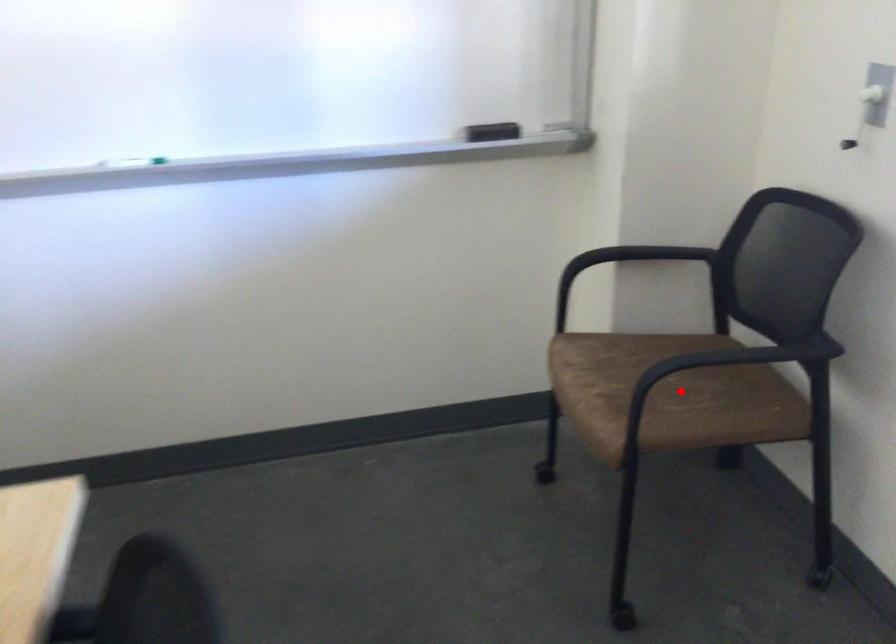
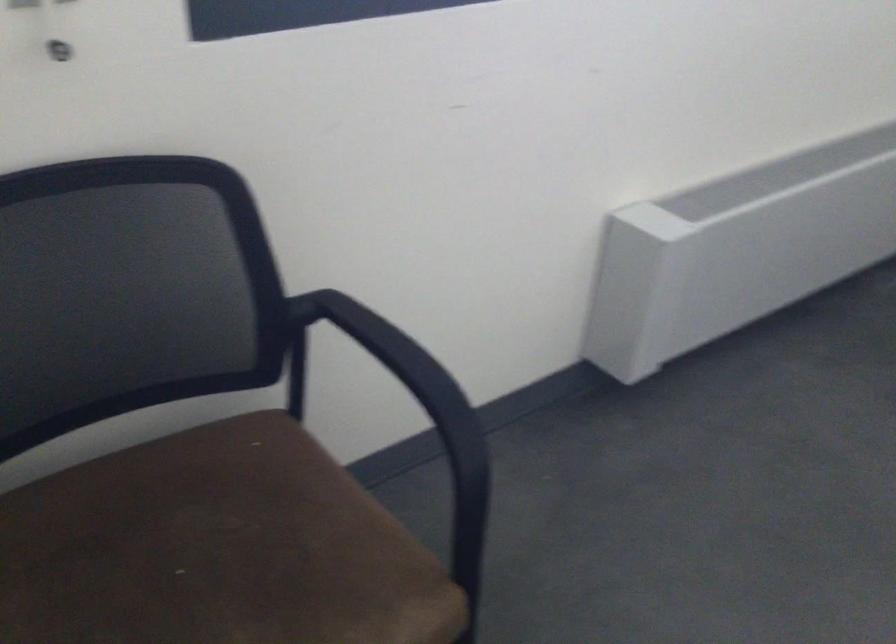
Question: I am providing you with two images of the same scene from different viewpoints. Given a red point in image1, look at the same physical point in image2. Is it:

Choices:
 (A) Closer to the viewpoint
 (B) Farther from the viewpoint

Answer: (A)